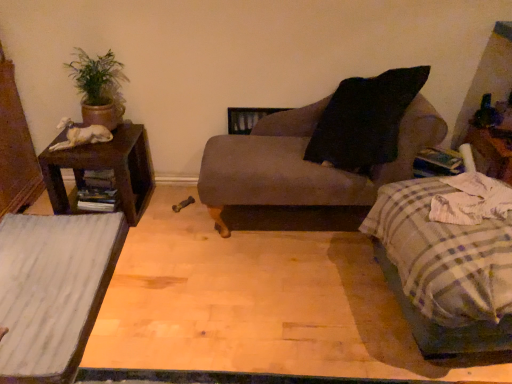
Identify the location of matte gray chaise at center. The height and width of the screenshot is (384, 512). (325, 148).

The width and height of the screenshot is (512, 384). Describe the element at coordinates (53, 290) in the screenshot. I see `white wood table at lower left` at that location.

What are the coordinates of `plaid fabric bed at lower right` in the screenshot? It's located at (444, 271).

You are a GUI agent. You are given a task and a screenshot of the screen. Output one action in this format:
    pyautogui.click(x=<x>, y=<y>)
    Task: Click on the brown wood nightstand at left
    Image resolution: width=512 pixels, height=384 pixels.
    Given the screenshot: What is the action you would take?
    pyautogui.click(x=106, y=169)

Locate an element on the screen. Image resolution: width=512 pixels, height=384 pixels. green matte plant at upper left is located at coordinates (99, 88).

Is matte gray chaise at center at the left side of brown wood nightstand at left?

No.

Is matte gray chaise at center oriented away from brown wood nightstand at left?

No, brown wood nightstand at left is not at the back of matte gray chaise at center.

Considering the sizes of objects matte gray chaise at center and brown wood nightstand at left in the image provided, who is taller, matte gray chaise at center or brown wood nightstand at left?

Standing taller between the two is matte gray chaise at center.

Considering their positions, is matte gray chaise at center located in front of or behind brown wood nightstand at left?

matte gray chaise at center is positioned closer to the viewer than brown wood nightstand at left.

Does matte gray chaise at center contain white wood table at lower left?

Actually, white wood table at lower left is outside matte gray chaise at center.

Is matte gray chaise at center at the left side of white wood table at lower left?

Incorrect, matte gray chaise at center is not on the left side of white wood table at lower left.

Does matte gray chaise at center have a greater width compared to white wood table at lower left?

Incorrect, the width of matte gray chaise at center does not surpass that of white wood table at lower left.

Can you see matte gray chaise at center touching white wood table at lower left?

There is a gap between matte gray chaise at center and white wood table at lower left.

Considering the relative sizes of plaid fabric bed at lower right and green matte plant at upper left in the image provided, is plaid fabric bed at lower right shorter than green matte plant at upper left?

Incorrect, the height of plaid fabric bed at lower right does not fall short of that of green matte plant at upper left.

Considering the positions of points (431, 287) and (110, 57), is point (431, 287) farther from camera compared to point (110, 57)?

No, (431, 287) is closer to viewer.

Is plaid fabric bed at lower right in contact with green matte plant at upper left?

No, plaid fabric bed at lower right is not next to green matte plant at upper left.

Is plaid fabric bed at lower right closer to the viewer compared to green matte plant at upper left?

→ Yes, it is in front of green matte plant at upper left.

Is green matte plant at upper left outside of plaid fabric bed at lower right?

green matte plant at upper left lies outside plaid fabric bed at lower right's area.

From a real-world perspective, is green matte plant at upper left located higher than plaid fabric bed at lower right?

Correct, in the physical world, green matte plant at upper left is higher than plaid fabric bed at lower right.

Who is taller, green matte plant at upper left or plaid fabric bed at lower right?

plaid fabric bed at lower right is taller.

Between green matte plant at upper left and plaid fabric bed at lower right, which one appears on the right side from the viewer's perspective?

From the viewer's perspective, plaid fabric bed at lower right appears more on the right side.

From a real-world perspective, is white wood table at lower left beneath brown wood nightstand at left?

Yes, from a real-world perspective, white wood table at lower left is beneath brown wood nightstand at left.

How distant is white wood table at lower left from brown wood nightstand at left?

The distance of white wood table at lower left from brown wood nightstand at left is 14.85 inches.

Is point (21, 344) closer or farther from the camera than point (138, 211)?

Point (21, 344) is positioned closer to the camera compared to point (138, 211).

Can you tell me how much white wood table at lower left and brown wood nightstand at left differ in facing direction?

90.9 degrees separate the facing orientations of white wood table at lower left and brown wood nightstand at left.

Is white wood table at lower left facing towards plaid fabric bed at lower right?

Yes.

Does white wood table at lower left appear on the left side of plaid fabric bed at lower right?

Correct, you'll find white wood table at lower left to the left of plaid fabric bed at lower right.

Is point (68, 258) behind point (459, 266)?

Yes, it is.

Does white wood table at lower left have a smaller size compared to plaid fabric bed at lower right?

Indeed, white wood table at lower left has a smaller size compared to plaid fabric bed at lower right.

Considering the points (103, 216) and (99, 65), which point is behind, point (103, 216) or point (99, 65)?

The point (99, 65) is farther from the camera.

Visually, is white wood table at lower left positioned to the left or to the right of green matte plant at upper left?

From the image, it's evident that white wood table at lower left is to the left of green matte plant at upper left.

Is white wood table at lower left positioned with its back to green matte plant at upper left?

That's not correct — white wood table at lower left is not looking away from green matte plant at upper left.

This screenshot has height=384, width=512. Find the location of `nightstand that appears below the matte gray chaise at center (from a real-world perspective)`. nightstand that appears below the matte gray chaise at center (from a real-world perspective) is located at coordinates (106, 169).

This screenshot has width=512, height=384. I want to click on chair that appears on the right of white wood table at lower left, so click(325, 148).

Which object lies nearer to the anchor point brown wood nightstand at left, plaid fabric bed at lower right or white wood table at lower left?

white wood table at lower left is closer to brown wood nightstand at left.

When comparing their distances from brown wood nightstand at left, does plaid fabric bed at lower right or green matte plant at upper left seem further?

plaid fabric bed at lower right is further to brown wood nightstand at left.

Which object lies nearer to the anchor point plaid fabric bed at lower right, green matte plant at upper left or matte gray chaise at center?

The object closer to plaid fabric bed at lower right is matte gray chaise at center.

Which object lies further to the anchor point white wood table at lower left, matte gray chaise at center or brown wood nightstand at left?

matte gray chaise at center is positioned further to the anchor white wood table at lower left.

Which object lies nearer to the anchor point plaid fabric bed at lower right, white wood table at lower left or brown wood nightstand at left?

white wood table at lower left is closer to plaid fabric bed at lower right.

When comparing their distances from green matte plant at upper left, does white wood table at lower left or brown wood nightstand at left seem closer?

The object closer to green matte plant at upper left is brown wood nightstand at left.

Based on their spatial positions, is green matte plant at upper left or brown wood nightstand at left further from white wood table at lower left?

green matte plant at upper left is positioned further to the anchor white wood table at lower left.

Which object lies further to the anchor point brown wood nightstand at left, matte gray chaise at center or white wood table at lower left?

matte gray chaise at center lies further to brown wood nightstand at left than the other object.

Locate an element on the screen. The width and height of the screenshot is (512, 384). houseplant between white wood table at lower left and plaid fabric bed at lower right in the horizontal direction is located at coordinates (99, 88).

At what (x,y) coordinates should I click in order to perform the action: click on chair between white wood table at lower left and plaid fabric bed at lower right. Please return your answer as a coordinate pair (x, y). This screenshot has width=512, height=384. Looking at the image, I should click on point(325,148).

Where is `chair situated between brown wood nightstand at left and plaid fabric bed at lower right from left to right`? The width and height of the screenshot is (512, 384). chair situated between brown wood nightstand at left and plaid fabric bed at lower right from left to right is located at coordinates (325, 148).

I want to click on nightstand situated between white wood table at lower left and plaid fabric bed at lower right from left to right, so click(x=106, y=169).